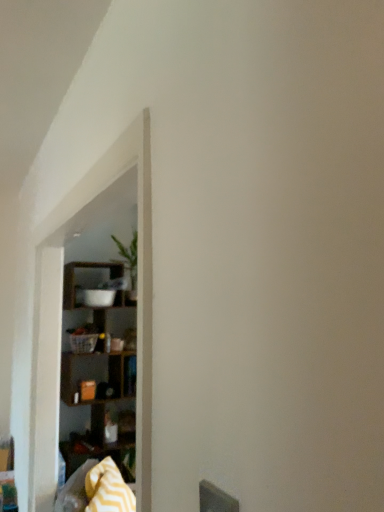
Question: Is green leafy plant at upper center further to the viewer compared to yellow zigzag blanket at lower left?

Choices:
 (A) yes
 (B) no

Answer: (A)

Question: Is green leafy plant at upper center taller than yellow zigzag blanket at lower left?

Choices:
 (A) no
 (B) yes

Answer: (B)

Question: Considering the relative positions of green leafy plant at upper center and yellow zigzag blanket at lower left in the image provided, is green leafy plant at upper center to the left of yellow zigzag blanket at lower left from the viewer's perspective?

Choices:
 (A) no
 (B) yes

Answer: (B)

Question: Considering the relative sizes of green leafy plant at upper center and yellow zigzag blanket at lower left in the image provided, is green leafy plant at upper center shorter than yellow zigzag blanket at lower left?

Choices:
 (A) no
 (B) yes

Answer: (A)

Question: Does green leafy plant at upper center come in front of yellow zigzag blanket at lower left?

Choices:
 (A) yes
 (B) no

Answer: (B)

Question: Is wooden shelf at center in front of or behind yellow zigzag blanket at lower left in the image?

Choices:
 (A) front
 (B) behind

Answer: (A)

Question: Based on their positions, is wooden shelf at center located to the left or right of yellow zigzag blanket at lower left?

Choices:
 (A) right
 (B) left

Answer: (B)

Question: From a real-world perspective, is wooden shelf at center above or below yellow zigzag blanket at lower left?

Choices:
 (A) below
 (B) above

Answer: (B)

Question: From the image's perspective, is wooden shelf at center above or below yellow zigzag blanket at lower left?

Choices:
 (A) above
 (B) below

Answer: (A)

Question: Considering the positions of point (x=124, y=396) and point (x=132, y=496), is point (x=124, y=396) closer or farther from the camera than point (x=132, y=496)?

Choices:
 (A) closer
 (B) farther

Answer: (B)

Question: Looking at their shapes, would you say wooden shelf at left is wider or thinner than yellow zigzag blanket at lower left?

Choices:
 (A) thin
 (B) wide

Answer: (B)

Question: From the image's perspective, is wooden shelf at left located above or below yellow zigzag blanket at lower left?

Choices:
 (A) below
 (B) above

Answer: (B)

Question: From a real-world perspective, is wooden shelf at left above or below yellow zigzag blanket at lower left?

Choices:
 (A) above
 (B) below

Answer: (A)

Question: Looking at their shapes, would you say wooden shelf at left is wider or thinner than wooden shelf at center?

Choices:
 (A) wide
 (B) thin

Answer: (A)

Question: In the image, is wooden shelf at left positioned in front of or behind wooden shelf at center?

Choices:
 (A) front
 (B) behind

Answer: (B)